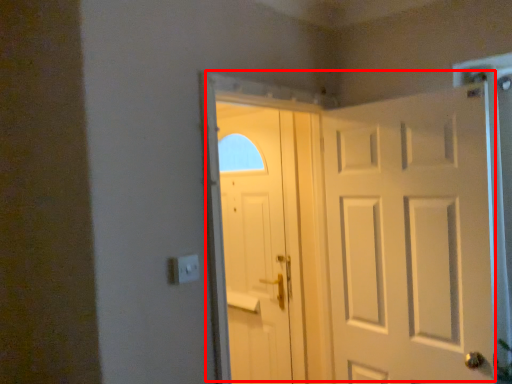
Question: Observing the image, what is the correct spatial positioning of door (annotated by the red box) in reference to door?

Choices:
 (A) left
 (B) right

Answer: (B)